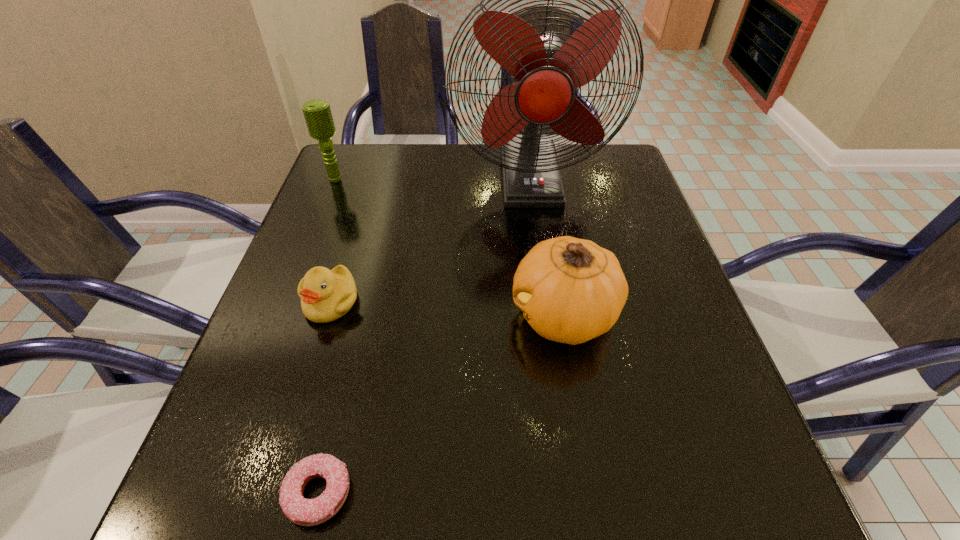
At what (x,y) coordinates should I click in order to perform the action: click on the tallest object. Please return your answer as a coordinate pair (x, y). Image resolution: width=960 pixels, height=540 pixels. Looking at the image, I should click on (544, 73).

You are a GUI agent. You are given a task and a screenshot of the screen. Output one action in this format:
    pyautogui.click(x=<x>, y=<y>)
    Task: Click on the microphone
    The width and height of the screenshot is (960, 540).
    Given the screenshot: What is the action you would take?
    pyautogui.click(x=317, y=113)

This screenshot has width=960, height=540. What are the coordinates of `pumpkin` in the screenshot? It's located at (570, 290).

Where is `duckling`? This screenshot has height=540, width=960. duckling is located at coordinates (326, 295).

Locate an element on the screen. Image resolution: width=960 pixels, height=540 pixels. the nearest object is located at coordinates (306, 512).

I want to click on the shortest object, so click(306, 512).

At what (x,y) coordinates should I click in order to perform the action: click on vacant area situated 0.340m on the front-facing side of the tallest object. Please return your answer as a coordinate pair (x, y). The height and width of the screenshot is (540, 960). Looking at the image, I should click on (550, 321).

You are a GUI agent. You are given a task and a screenshot of the screen. Output one action in this format:
    pyautogui.click(x=<x>, y=<y>)
    Task: Click on the vacant area located on the right of the microphone
    Image resolution: width=960 pixels, height=540 pixels.
    Given the screenshot: What is the action you would take?
    pyautogui.click(x=378, y=178)

Locate an element on the screen. The height and width of the screenshot is (540, 960). free point located 0.130m on the front face of the pumpkin is located at coordinates point(442,315).

Where is `vacant space located on the front face of the pumpkin`? vacant space located on the front face of the pumpkin is located at coordinates (420, 315).